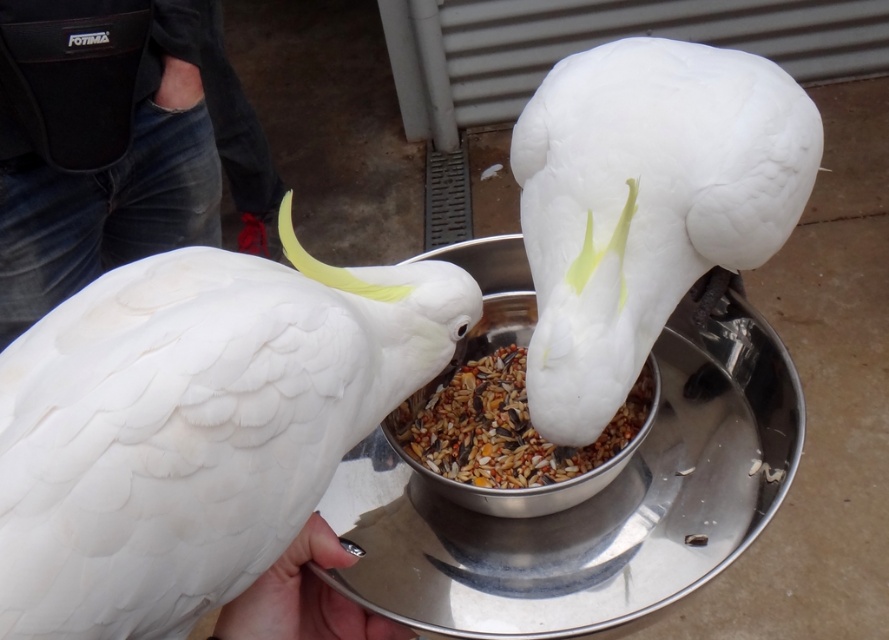
You are a photographer trying to capture the cockatoos feeding from the metal bowl. You notice the jeans at left and the multicolored grain mix at center in your frame. Which object should you adjust your camera angle to focus on if you want to highlight the one that is taller?

The jeans at left is much taller than the multicolored grain mix at center, so you should adjust your camera angle to focus on the jeans at left to highlight the taller object.